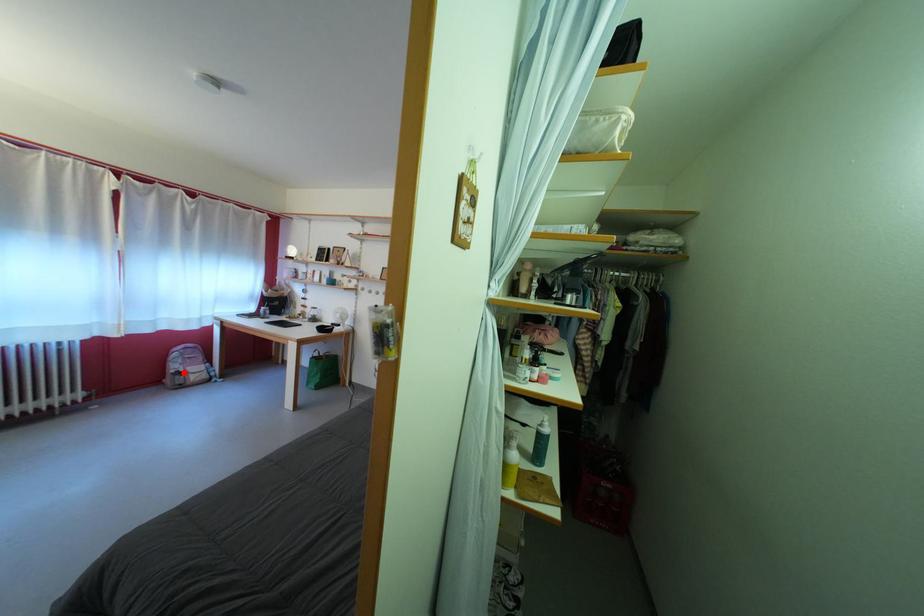
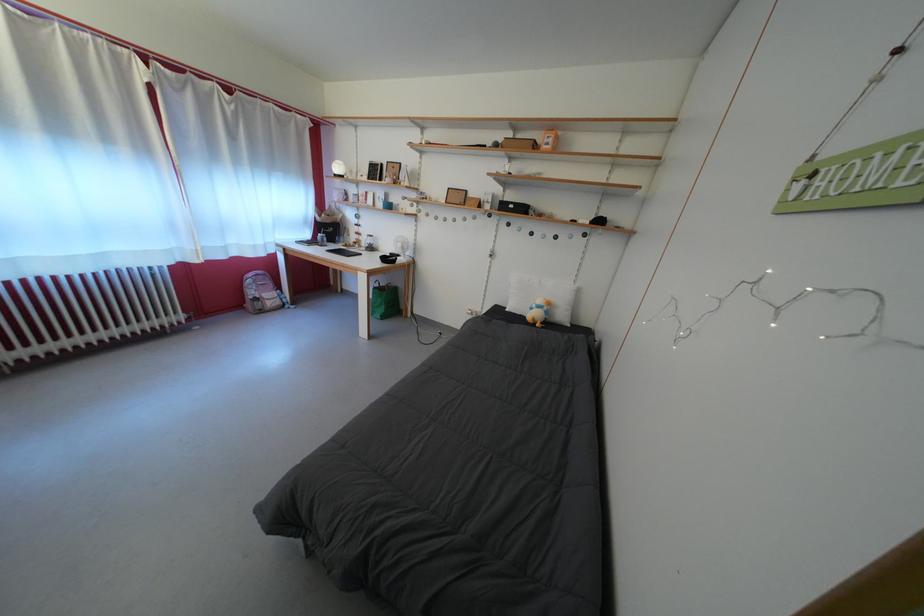
Question: I am providing you with two images of the same scene from different viewpoints. In image1, a red point is highlighted. Considering the same 3D point in image2, which of the following is correct?

Choices:
 (A) It is closer
 (B) It is farther

Answer: (A)